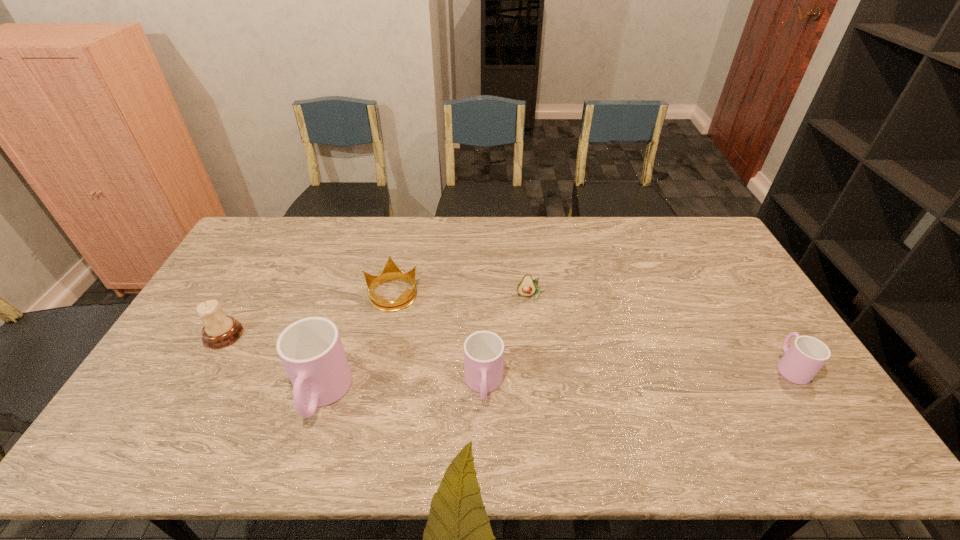
If we want them evenly spaced by inserting an extra cup among them, please locate a free spot for this new cup. Please provide its 2D coordinates. Your answer should be formatted as a tuple, i.e. [(x, y)], where the tuple contains the x and y coordinates of a point satisfying the conditions above.

[(639, 376)]